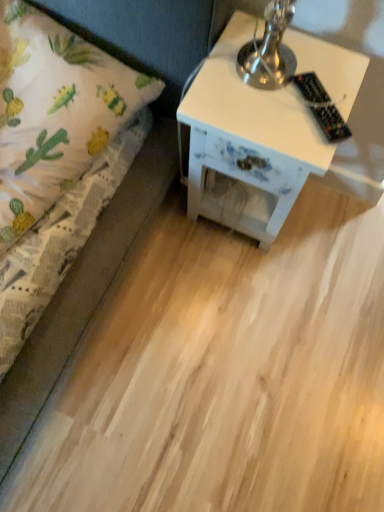
The height and width of the screenshot is (512, 384). Find the location of `unoccupied region to the right of white painted wood nightstand at right`. unoccupied region to the right of white painted wood nightstand at right is located at coordinates (336, 229).